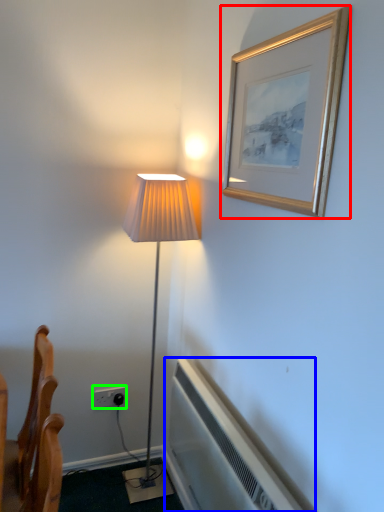
Question: Which object is the closest to the picture frame (highlighted by a red box)? Choose among these: air conditioner (highlighted by a blue box) or electric outlet (highlighted by a green box).

Choices:
 (A) air conditioner
 (B) electric outlet

Answer: (A)